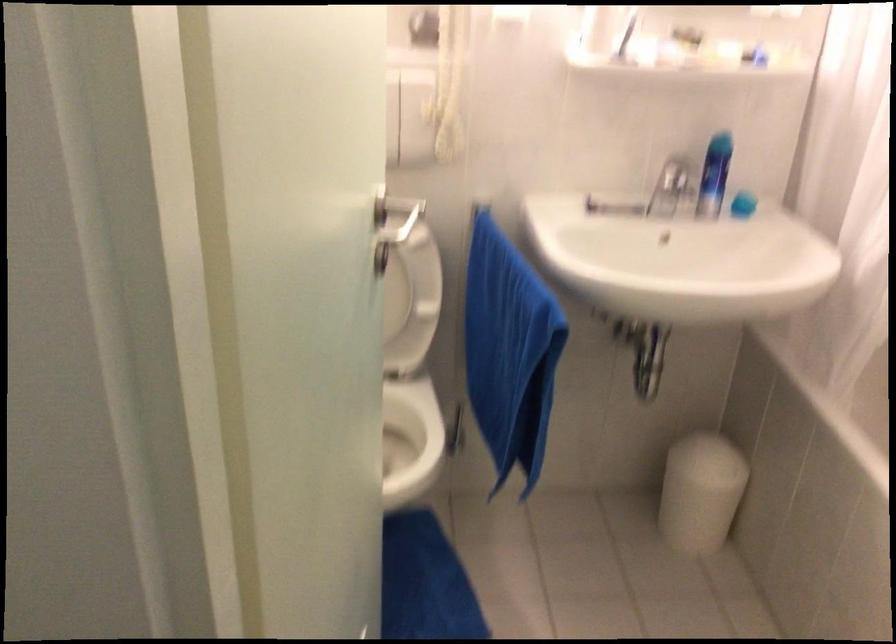
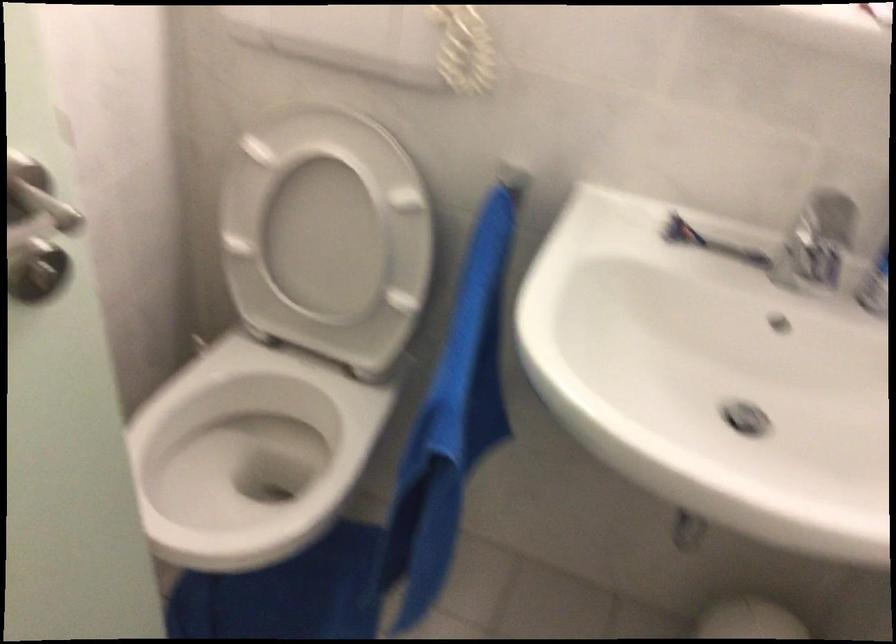
Question: The images are taken continuously from a first-person perspective. In which direction is your viewpoint rotating?

Choices:
 (A) Left
 (B) Right
 (C) Up
 (D) Down

Answer: (A)